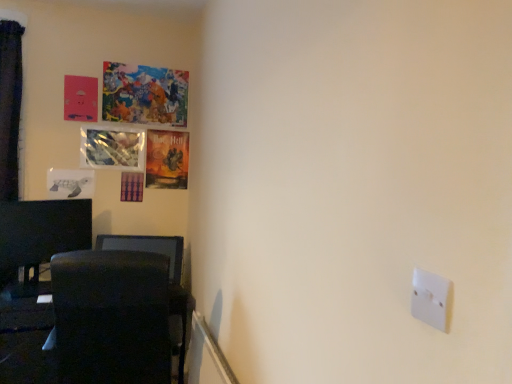
Question: Is matte paper poster at upper left, which ranks as the third picture frame in top-to-bottom order, touching black glossy monitor at left?

Choices:
 (A) no
 (B) yes

Answer: (A)

Question: Can you confirm if matte paper poster at upper left, which ranks as the third picture frame in top-to-bottom order, is smaller than black glossy monitor at left?

Choices:
 (A) yes
 (B) no

Answer: (A)

Question: Does matte paper poster at upper left, the 2th picture frame when ordered from bottom to top, have a greater width compared to black glossy monitor at left?

Choices:
 (A) no
 (B) yes

Answer: (A)

Question: Does matte paper poster at upper left, which ranks as the third picture frame in top-to-bottom order, have a lesser height compared to black glossy monitor at left?

Choices:
 (A) no
 (B) yes

Answer: (B)

Question: Is matte paper poster at upper left, the 2th picture frame when ordered from bottom to top, thinner than black glossy monitor at left?

Choices:
 (A) yes
 (B) no

Answer: (A)

Question: From a real-world perspective, is white paper turtle at left, which ranks as the first picture frame in bottom-to-top order, positioned above or below metallic reflective picture frame at upper left, which appears as the third picture frame when ordered from the bottom?

Choices:
 (A) below
 (B) above

Answer: (A)

Question: Looking at their shapes, would you say white paper turtle at left, positioned as the 4th picture frame in top-to-bottom order, is wider or thinner than metallic reflective picture frame at upper left, which is the second picture frame in top-to-bottom order?

Choices:
 (A) thin
 (B) wide

Answer: (A)

Question: In the image, is white paper turtle at left, which ranks as the first picture frame in bottom-to-top order, positioned in front of or behind metallic reflective picture frame at upper left, which appears as the third picture frame when ordered from the bottom?

Choices:
 (A) behind
 (B) front

Answer: (B)

Question: Choose the correct answer: Is white paper turtle at left, which ranks as the first picture frame in bottom-to-top order, inside metallic reflective picture frame at upper left, which is the second picture frame in top-to-bottom order, or outside it?

Choices:
 (A) outside
 (B) inside

Answer: (A)

Question: Considering the positions of painted canvas artwork at upper left, the fourth picture frame from the bottom, and matte paper poster at upper left, which ranks as the third picture frame in top-to-bottom order, in the image, is painted canvas artwork at upper left, the fourth picture frame from the bottom, wider or thinner than matte paper poster at upper left, which ranks as the third picture frame in top-to-bottom order,?

Choices:
 (A) wide
 (B) thin

Answer: (B)

Question: From the image's perspective, is painted canvas artwork at upper left, the first picture frame when ordered from top to bottom, positioned above or below matte paper poster at upper left, which ranks as the third picture frame in top-to-bottom order?

Choices:
 (A) above
 (B) below

Answer: (A)

Question: Relative to matte paper poster at upper left, which ranks as the third picture frame in top-to-bottom order, is painted canvas artwork at upper left, the fourth picture frame from the bottom, in front or behind?

Choices:
 (A) front
 (B) behind

Answer: (A)

Question: Choose the correct answer: Is painted canvas artwork at upper left, the first picture frame when ordered from top to bottom, inside matte paper poster at upper left, the 2th picture frame when ordered from bottom to top, or outside it?

Choices:
 (A) inside
 (B) outside

Answer: (B)

Question: Considering the positions of black fabric swivel chair at lower left and painted canvas artwork at upper left, the fourth picture frame from the bottom, in the image, is black fabric swivel chair at lower left bigger or smaller than painted canvas artwork at upper left, the fourth picture frame from the bottom,?

Choices:
 (A) small
 (B) big

Answer: (B)

Question: Looking at their shapes, would you say black fabric swivel chair at lower left is wider or thinner than painted canvas artwork at upper left, the fourth picture frame from the bottom?

Choices:
 (A) wide
 (B) thin

Answer: (A)